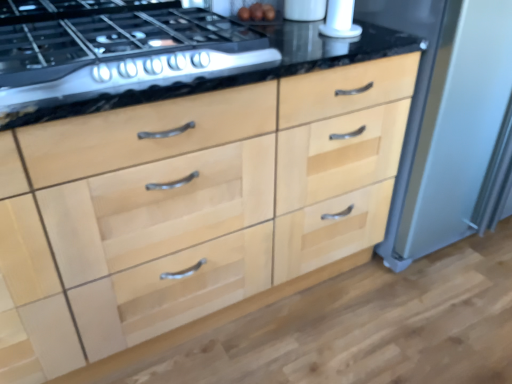
Question: Is white glossy salt shaker at upper right, the 1th appliance in the left-to-right sequence, inside satin black gas stove at upper left?

Choices:
 (A) yes
 (B) no

Answer: (B)

Question: From the image's perspective, would you say satin black gas stove at upper left is positioned over white glossy salt shaker at upper right, which is the second appliance from right to left?

Choices:
 (A) no
 (B) yes

Answer: (A)

Question: Does satin black gas stove at upper left have a lesser height compared to white glossy salt shaker at upper right, the 1th appliance in the left-to-right sequence?

Choices:
 (A) no
 (B) yes

Answer: (B)

Question: Is satin black gas stove at upper left not inside white glossy salt shaker at upper right, which is the second appliance from right to left?

Choices:
 (A) yes
 (B) no

Answer: (A)

Question: Is satin black gas stove at upper left further to camera compared to white glossy salt shaker at upper right, which is the second appliance from right to left?

Choices:
 (A) no
 (B) yes

Answer: (A)

Question: From a real-world perspective, is white glossy salt shaker at upper right, the 1th appliance in the left-to-right sequence, physically located above or below satin silver refrigerator at right, which is the 1th appliance from right to left?

Choices:
 (A) above
 (B) below

Answer: (A)

Question: Is white glossy salt shaker at upper right, the 1th appliance in the left-to-right sequence, bigger or smaller than satin silver refrigerator at right, which is the 1th appliance from right to left?

Choices:
 (A) big
 (B) small

Answer: (B)

Question: From the image's perspective, is white glossy salt shaker at upper right, the 1th appliance in the left-to-right sequence, positioned above or below satin silver refrigerator at right, which is the 2th appliance in left-to-right order?

Choices:
 (A) above
 (B) below

Answer: (A)

Question: Based on their positions, is white glossy salt shaker at upper right, which is the second appliance from right to left, located to the left or right of satin silver refrigerator at right, which is the 2th appliance in left-to-right order?

Choices:
 (A) left
 (B) right

Answer: (A)

Question: In terms of height, does natural wood drawers at center look taller or shorter compared to satin black gas stove at upper left?

Choices:
 (A) short
 (B) tall

Answer: (B)

Question: Considering their positions, is natural wood drawers at center located in front of or behind satin black gas stove at upper left?

Choices:
 (A) front
 (B) behind

Answer: (A)

Question: Considering the positions of natural wood drawers at center and satin black gas stove at upper left in the image, is natural wood drawers at center wider or thinner than satin black gas stove at upper left?

Choices:
 (A) wide
 (B) thin

Answer: (A)

Question: From the image's perspective, is natural wood drawers at center above or below satin black gas stove at upper left?

Choices:
 (A) below
 (B) above

Answer: (A)

Question: Is natural wood drawers at center to the left or to the right of white glossy salt shaker at upper right, which is the second appliance from right to left, in the image?

Choices:
 (A) right
 (B) left

Answer: (B)

Question: Is natural wood drawers at center bigger or smaller than white glossy salt shaker at upper right, the 1th appliance in the left-to-right sequence?

Choices:
 (A) big
 (B) small

Answer: (A)